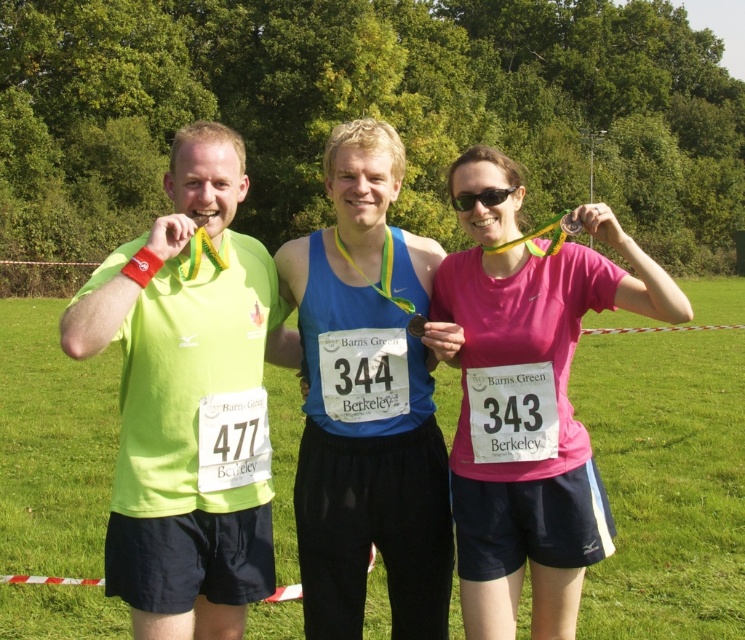
Does blue fabric tank top at center lie behind pink matte shirt at center?

That is True.

Between point (305, 522) and point (516, 209), which one is positioned in front?

Point (516, 209) is in front.

Between point (329, 264) and point (545, 333), which one is positioned behind?

The point (329, 264) is more distant.

Locate an element on the screen. blue fabric tank top at center is located at coordinates (367, 401).

Which is more to the left, matte green shirt at left or pink matte shirt at center?

Positioned to the left is matte green shirt at left.

Find the location of a particular element. This screenshot has width=745, height=640. matte green shirt at left is located at coordinates (186, 396).

I want to click on matte green shirt at left, so click(x=186, y=396).

Can you confirm if matte green shirt at left is smaller than blue fabric tank top at center?

Yes.

Does point (183, 296) lie in front of point (336, 291)?

Yes, point (183, 296) is closer to viewer.

Locate an element on the screen. Image resolution: width=745 pixels, height=640 pixels. matte green shirt at left is located at coordinates (186, 396).